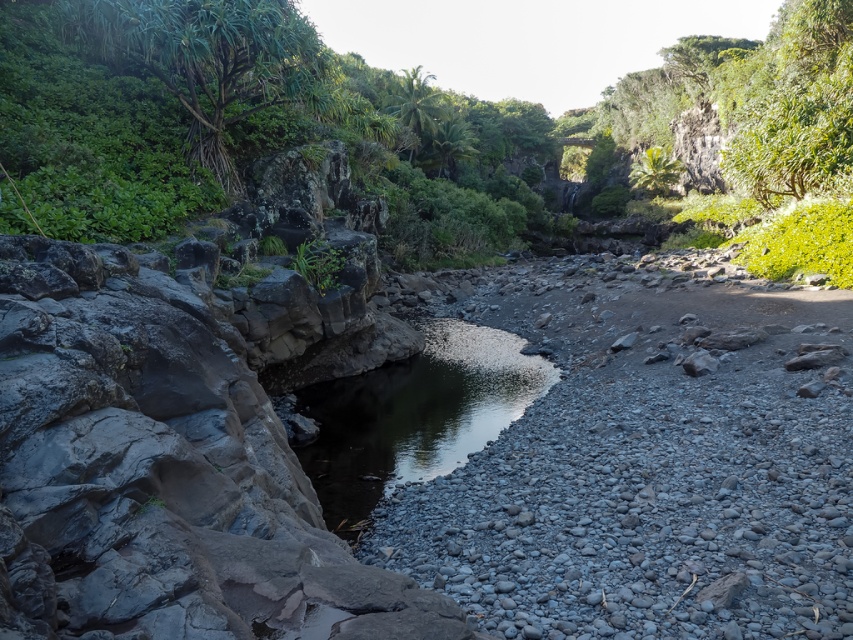
You are a hiker trying to cross the riverbed. You see the green leafy shrubs at center and the clear water at center. Which object is positioned to the right of the other?

The green leafy shrubs at center are to the right of the clear water at center.

You are a hiker who wants to cross the riverbed. You see the green leafy shrubs at center and the clear water at center. Which one is higher in elevation?

The green leafy shrubs at center are taller than the clear water at center, so the shrubs are higher in elevation.

You are a hiker who wants to cross from the rocky riverbed to the clear water at center without getting your shoes wet. The green leafy shrubs at center are in your way. Can you walk around them while staying on dry ground? Explain your reasoning based on the distance between them and the water.

The green leafy shrubs at center are 29.43 meters away from the clear water at center. Since the shrubs are far from the water, you can walk around them on the dry riverbed to reach the clear water at center without getting your shoes wet.